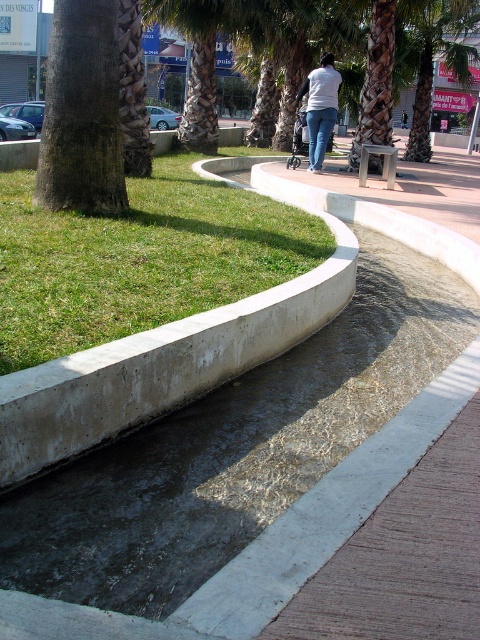
Which is behind, point (288, 225) or point (326, 74)?

The point (326, 74) is more distant.

Is green grass at lower left above white matte shirt at center?

No.

Where is `green grass at lower left`? This screenshot has height=640, width=480. green grass at lower left is located at coordinates (139, 259).

Can you confirm if green grass at lower left is positioned above brown rough tree trunk at left?

No.

Does green grass at lower left appear on the right side of brown rough tree trunk at left?

Correct, you'll find green grass at lower left to the right of brown rough tree trunk at left.

This screenshot has width=480, height=640. What are the coordinates of `green grass at lower left` in the screenshot? It's located at coord(139,259).

Can you confirm if brown rough tree trunk at left is shorter than green leafy palm tree at upper center?

Incorrect, brown rough tree trunk at left's height does not fall short of green leafy palm tree at upper center's.

Who is positioned more to the right, brown rough tree trunk at left or green leafy palm tree at upper center?

green leafy palm tree at upper center is more to the right.

Identify the location of brown rough tree trunk at left. The width and height of the screenshot is (480, 640). (82, 113).

Locate an element on the screen. This screenshot has height=640, width=480. brown rough tree trunk at left is located at coordinates (82, 113).